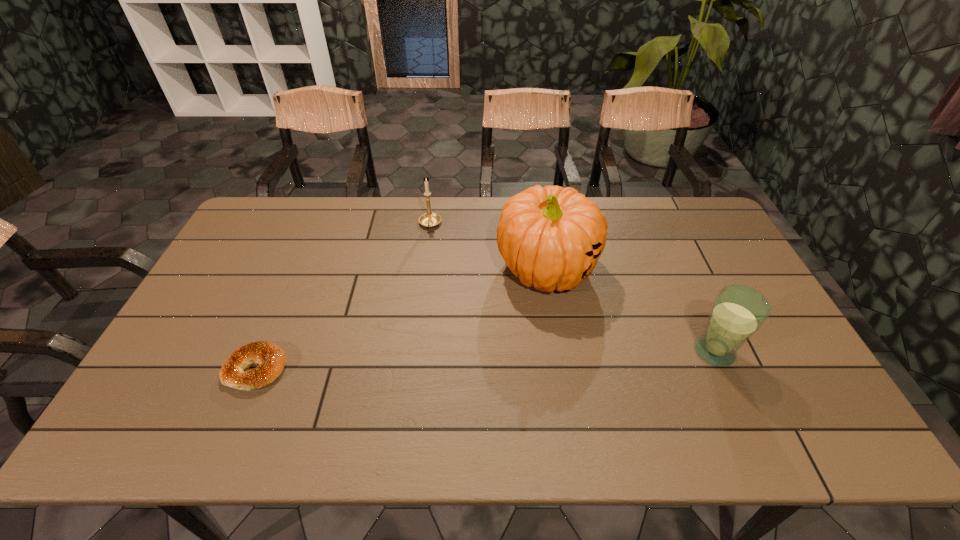
At what (x,y) coordinates should I click in order to perform the action: click on free space on the desktop that is between the shortest object and the glass and is positioned on the surface of the second farthest object. Please return your answer as a coordinate pair (x, y). Looking at the image, I should click on (555, 357).

Identify the location of free space on the desktop that is between the leftmost object and the glass and is positioned on the handle side of the farthest object. (420, 362).